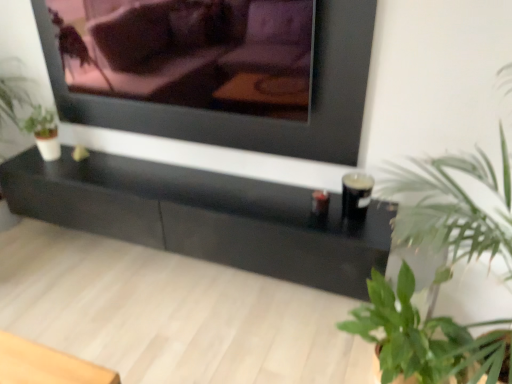
Question: Does matte black couch at upper center appear on the right side of matte black frame at upper center?

Choices:
 (A) yes
 (B) no

Answer: (B)

Question: Does matte black couch at upper center have a lesser height compared to matte black frame at upper center?

Choices:
 (A) yes
 (B) no

Answer: (A)

Question: From the image's perspective, is matte black couch at upper center below matte black frame at upper center?

Choices:
 (A) no
 (B) yes

Answer: (A)

Question: Is matte black couch at upper center located outside matte black frame at upper center?

Choices:
 (A) no
 (B) yes

Answer: (B)

Question: Does matte black couch at upper center have a smaller size compared to matte black frame at upper center?

Choices:
 (A) yes
 (B) no

Answer: (B)

Question: From the image's perspective, is green leafy plant at lower right, positioned as the 1th houseplant in bottom-to-top order, above or below black glossy table at center?

Choices:
 (A) above
 (B) below

Answer: (B)

Question: In the image, is green leafy plant at lower right, positioned as the 1th houseplant in bottom-to-top order, on the left side or the right side of black glossy table at center?

Choices:
 (A) right
 (B) left

Answer: (A)

Question: Does point (437, 344) appear closer or farther from the camera than point (245, 251)?

Choices:
 (A) farther
 (B) closer

Answer: (B)

Question: From their relative heights in the image, would you say green leafy plant at lower right, positioned as the 1th houseplant in bottom-to-top order, is taller or shorter than black glossy table at center?

Choices:
 (A) short
 (B) tall

Answer: (B)

Question: Does point (501, 72) appear closer or farther from the camera than point (117, 100)?

Choices:
 (A) closer
 (B) farther

Answer: (A)

Question: Is green leafy plant at right, acting as the 2th houseplant starting from the bottom, bigger or smaller than matte black frame at upper center?

Choices:
 (A) big
 (B) small

Answer: (A)

Question: From a real-world perspective, is green leafy plant at right, the 1th houseplant from the top, positioned above or below matte black frame at upper center?

Choices:
 (A) above
 (B) below

Answer: (B)

Question: In terms of width, does green leafy plant at right, acting as the 2th houseplant starting from the bottom, look wider or thinner when compared to matte black frame at upper center?

Choices:
 (A) wide
 (B) thin

Answer: (A)

Question: Considering their positions, is black glossy table at center located in front of or behind matte black frame at upper center?

Choices:
 (A) behind
 (B) front

Answer: (A)

Question: In terms of width, does black glossy table at center look wider or thinner when compared to matte black frame at upper center?

Choices:
 (A) wide
 (B) thin

Answer: (A)